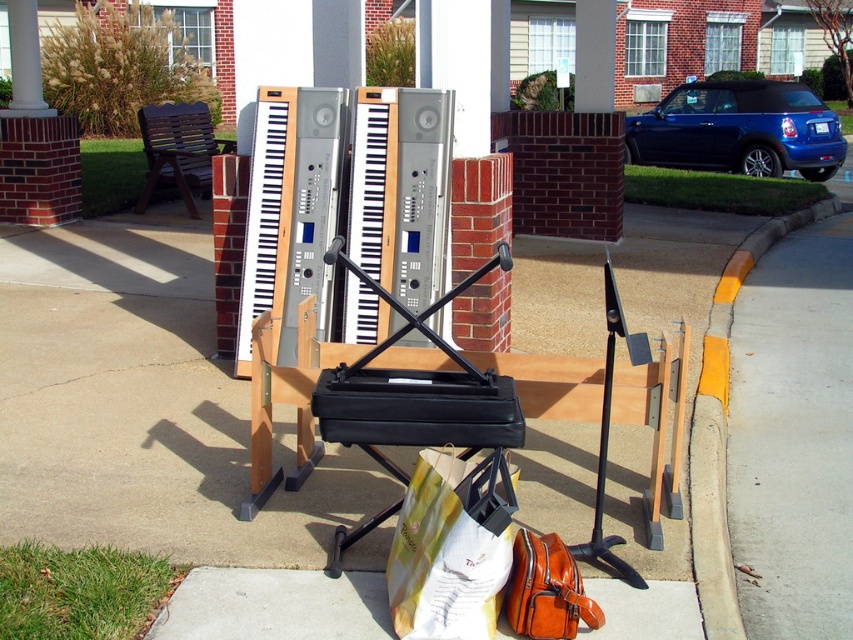
Consider the image. Is white paper bag at center thinner than yellow painted curb at lower right?

Yes.

Who is shorter, white paper bag at center or yellow painted curb at lower right?

With less height is white paper bag at center.

Is point (454, 620) positioned behind point (700, 516)?

No, (454, 620) is in front of (700, 516).

The height and width of the screenshot is (640, 853). What are the coordinates of `white paper bag at center` in the screenshot? It's located at (451, 547).

The width and height of the screenshot is (853, 640). I want to click on leather handbag at lower center, so click(x=274, y=605).

Who is higher up, leather handbag at lower center or brown leather bag at lower center?

brown leather bag at lower center is above.

Between point (329, 637) and point (520, 557), which one is positioned in front?

Point (329, 637) is in front.

The width and height of the screenshot is (853, 640). I want to click on leather handbag at lower center, so click(x=274, y=605).

Does wooden accordion at center have a lesser height compared to leather handbag at lower center?

No.

Does wooden accordion at center have a smaller size compared to leather handbag at lower center?

No.

Find the location of a particular element. The height and width of the screenshot is (640, 853). wooden accordion at center is located at coordinates (329, 196).